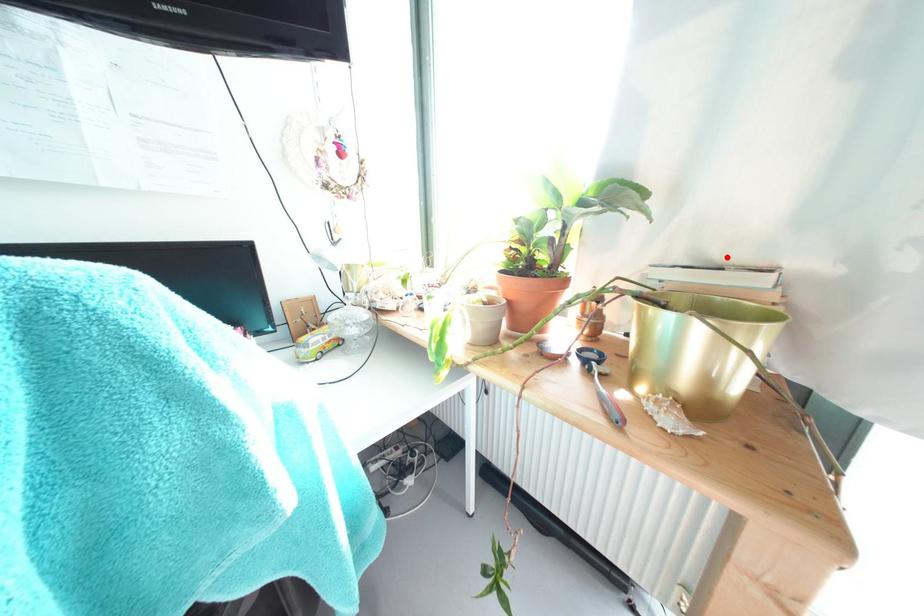
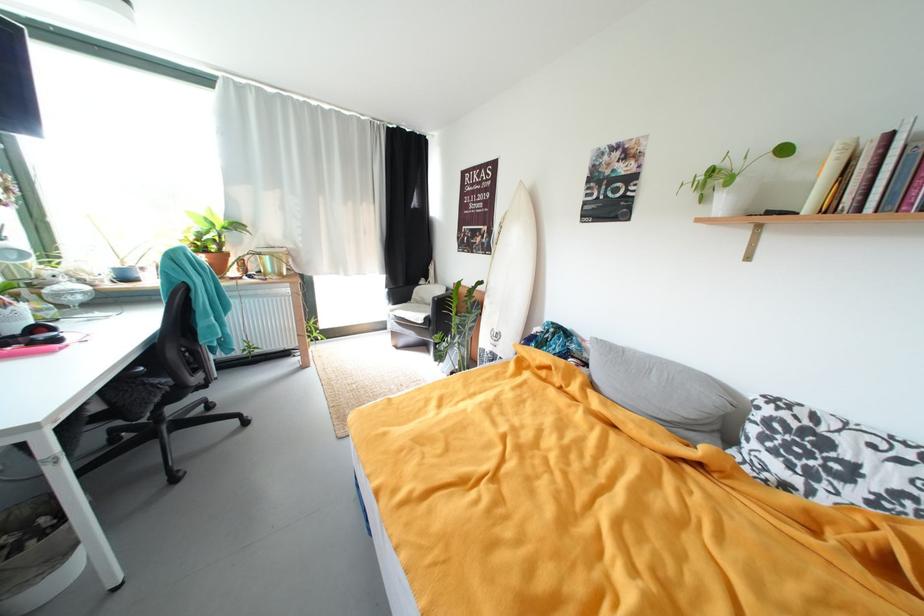
In the second image, find the point that corresponds to the highlighted location in the first image.

(281, 246)